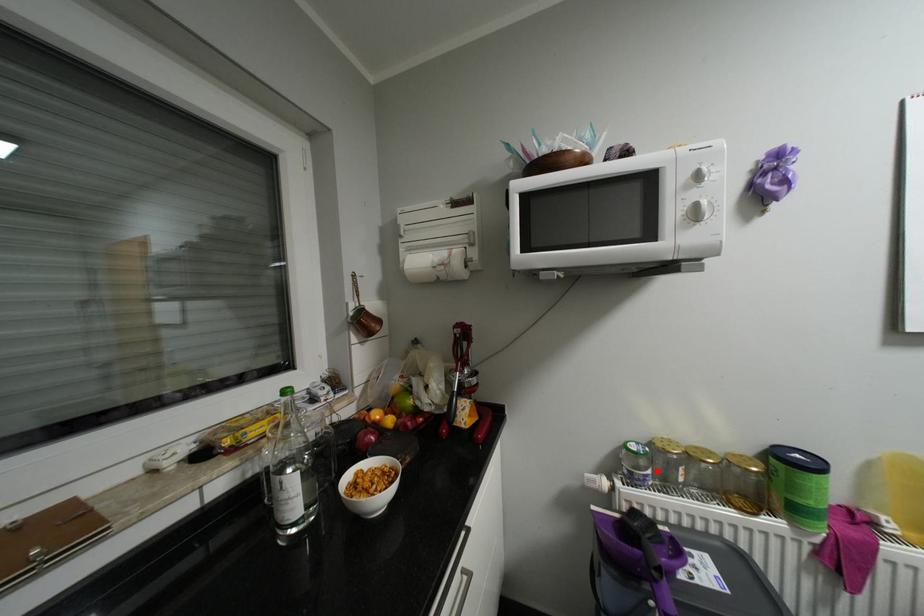
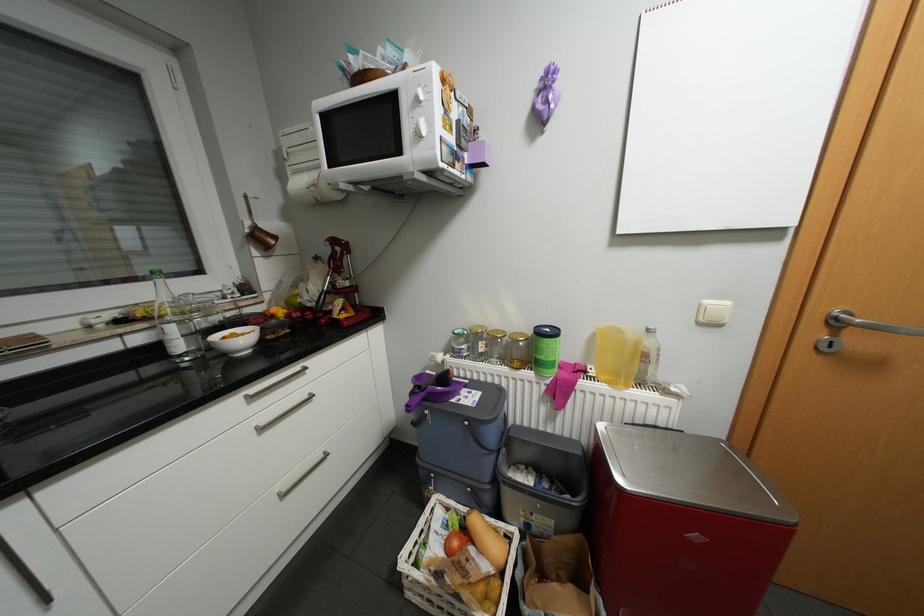
The point at the highlighted location is marked in the first image. Where is the corresponding point in the second image?

(471, 345)